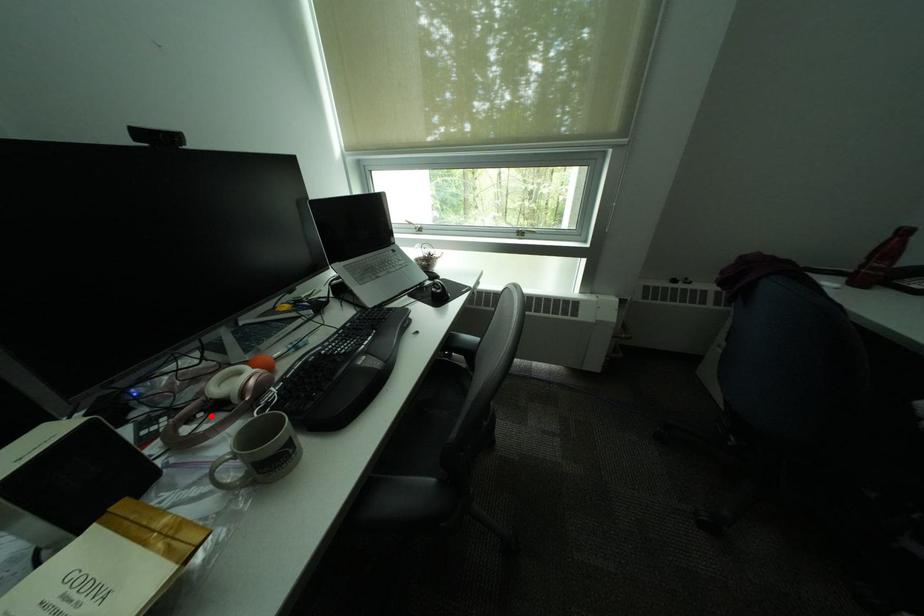
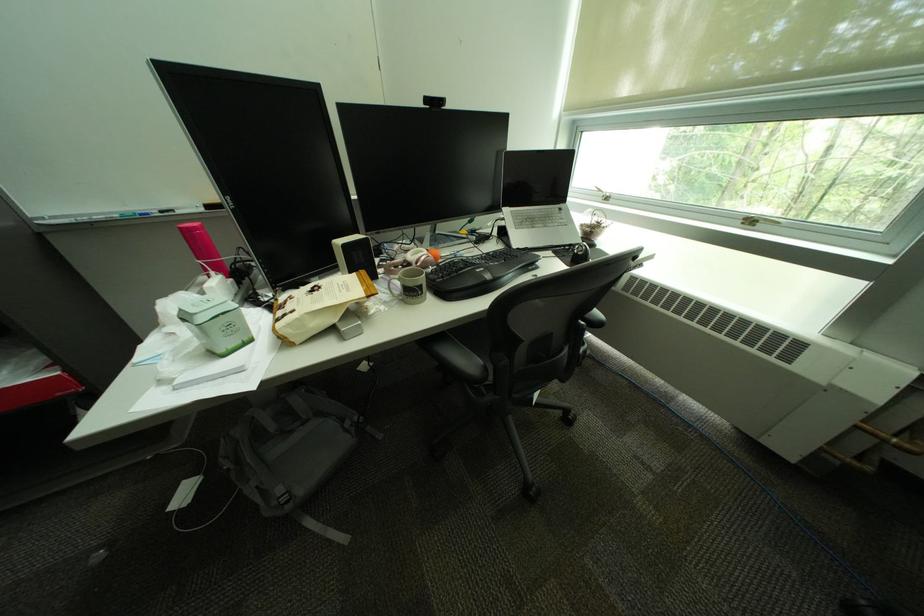
The point at the highlighted location is marked in the first image. Where is the corresponding point in the second image?

(410, 268)